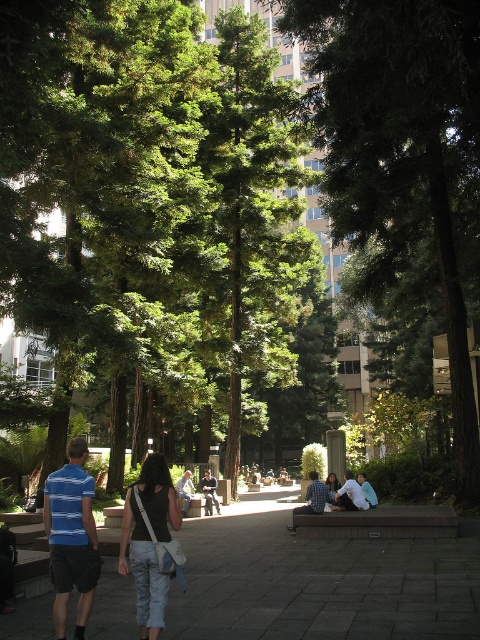
You are a photographer trying to capture a candid shot of the two people in the park. You want to ensure that both the blue striped shirt at center and the denim jacket at center are visible in the frame. Which person should you focus on first if you want to include both in your shot without moving the camera?

The blue striped shirt at center is positioned on the left side of denim jacket at center, so you should focus on the blue striped shirt at center first to ensure both are in frame.

You are standing at the point marked as point (72, 536) in the park. Which object is exactly at your current location?

The blue striped shirt at center is located at point (72, 536).